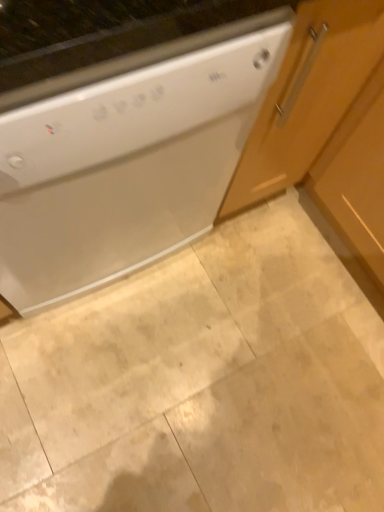
Question: Which is correct: beige marble floor at center is inside white glossy dishwasher at upper left, or outside of it?

Choices:
 (A) outside
 (B) inside

Answer: (A)

Question: Relative to white glossy dishwasher at upper left, is beige marble floor at center in front or behind?

Choices:
 (A) front
 (B) behind

Answer: (B)

Question: Which object is the closest to the beige marble floor at center?

Choices:
 (A) wooden cabinet at right
 (B) white glossy dishwasher at upper left

Answer: (B)

Question: Which is farther from the beige marble floor at center?

Choices:
 (A) wooden cabinet at right
 (B) white glossy dishwasher at upper left

Answer: (A)